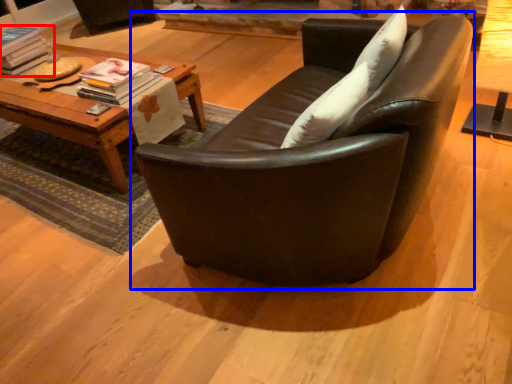
Question: Which object is closer to the camera taking this photo, magazine (highlighted by a red box) or studio couch (highlighted by a blue box)?

Choices:
 (A) magazine
 (B) studio couch

Answer: (B)